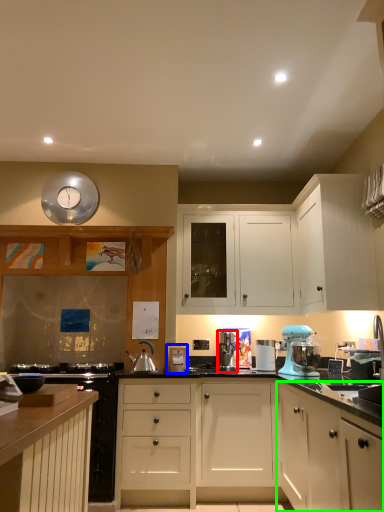
Question: Which object is the farthest from kitchen appliance (highlighted by a red box)? Choose among these: appliance (highlighted by a blue box) or cabinetry (highlighted by a green box).

Choices:
 (A) appliance
 (B) cabinetry

Answer: (B)